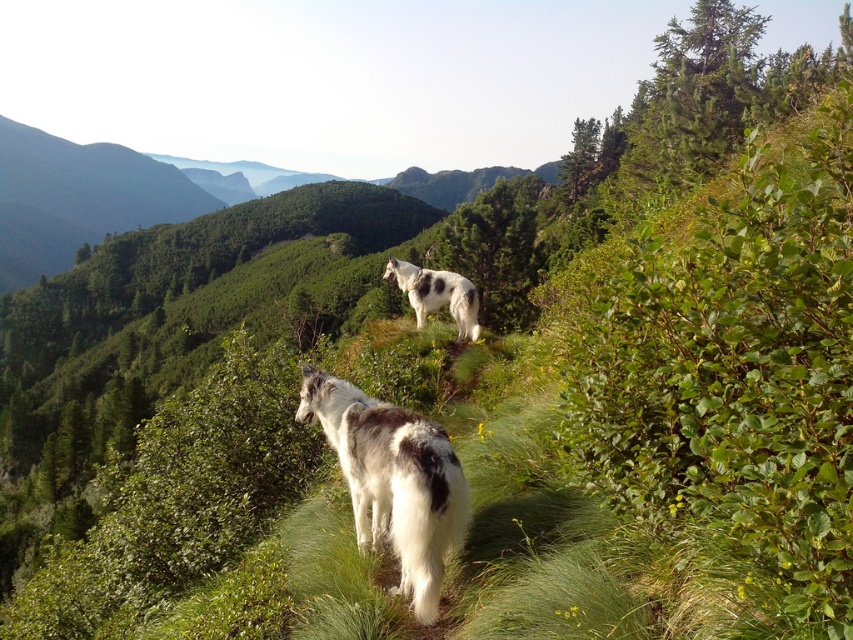
You are a photographer trying to capture both the white woolen pony at center and the white speckled fur pony at center in a single shot. Which pony should you adjust your camera focus to first to ensure both are in frame?

You should focus on the white speckled fur pony at center first because the white woolen pony at center is to the left of it, so adjusting focus from right to left will help capture both ponies in the frame.

You are standing at the point labeled point (x=426, y=433) and want to walk to the point labeled point (x=476, y=326). Which direction should you face to move towards your destination?

You should face away from the camera because point (x=476, y=326) is further from the camera than point (x=426, y=433).